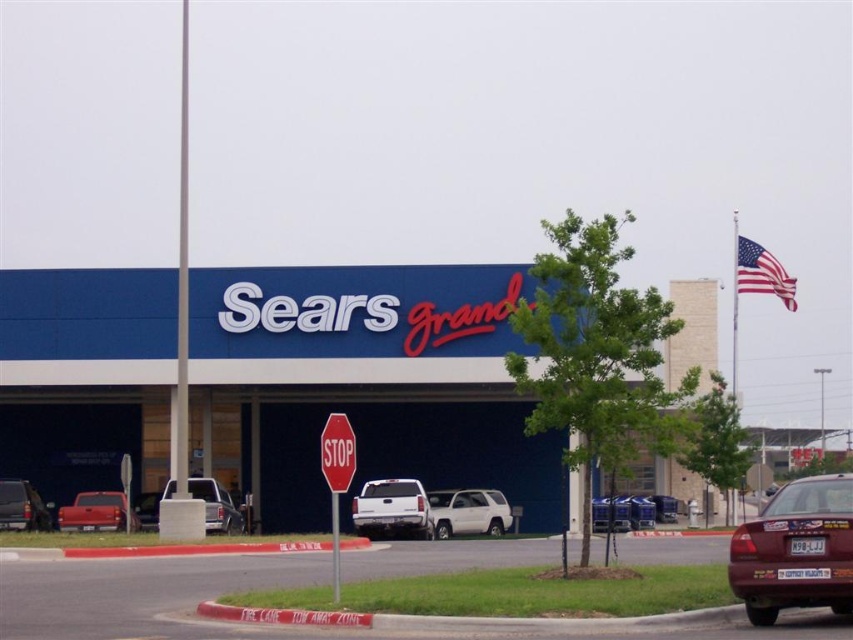
Question: Is the position of maroon matte car at lower right more distant than that of metallic silver truck at center?

Choices:
 (A) yes
 (B) no

Answer: (B)

Question: Is blue/white building at center positioned in front of american flag at upper right?

Choices:
 (A) no
 (B) yes

Answer: (B)

Question: Considering the real-world distances, which object is farthest from the maroon matte car at lower right?

Choices:
 (A) silver metallic truck at center
 (B) white matte truck at center

Answer: (B)

Question: Which point appears closest to the camera in this image?

Choices:
 (A) (1, 506)
 (B) (138, 524)
 (C) (753, 243)
 (D) (212, 528)

Answer: (D)

Question: Which object appears farthest from the camera in this image?

Choices:
 (A) maroon matte car at lower right
 (B) white matte suv at center
 (C) red matte stop sign at center
 (D) white matte truck at center

Answer: (B)

Question: Is white matte suv at center behind matte red truck at lower left?

Choices:
 (A) no
 (B) yes

Answer: (B)